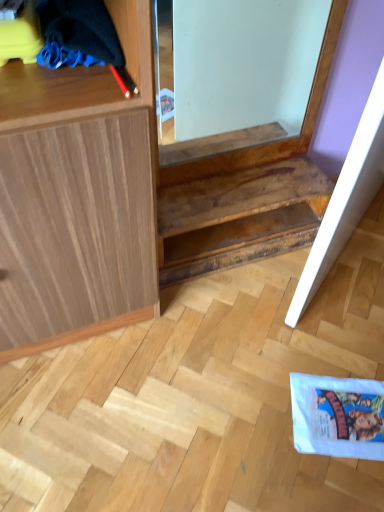
What is the approximate width of blue fabric at upper left?

It is 26.27 centimeters.

This screenshot has width=384, height=512. What are the coordinates of `blue fabric at upper left` in the screenshot? It's located at (78, 34).

What do you see at coordinates (78, 34) in the screenshot? I see `blue fabric at upper left` at bounding box center [78, 34].

At what (x,y) coordinates should I click in order to perform the action: click on blue fabric at upper left. Please return your answer as a coordinate pair (x, y). The image size is (384, 512). Looking at the image, I should click on (78, 34).